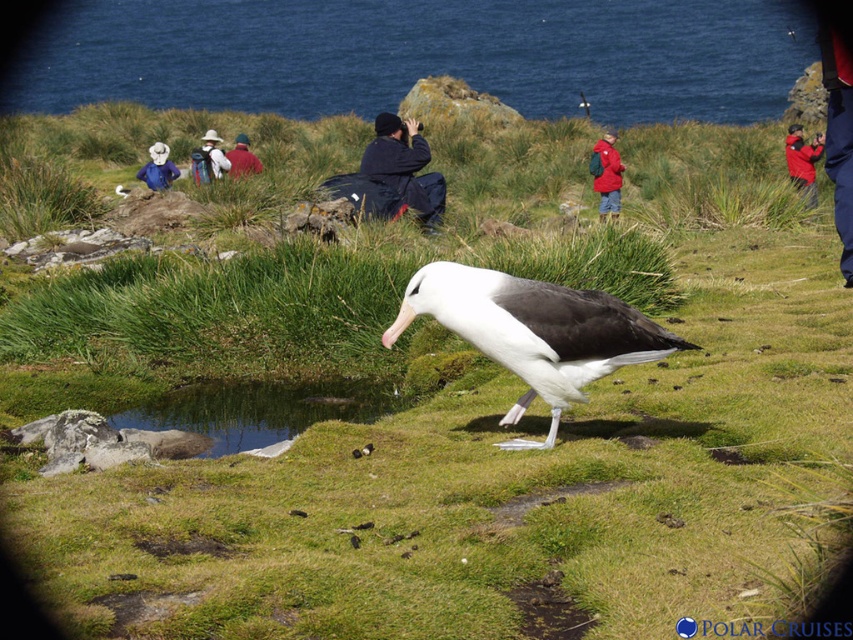
You are a photographer trying to capture a group photo of the people in the scene. You want to ensure both the red fabric jacket at center and the white matte jacket at upper left are visible in the frame. Based on their positions, which jacket should you position closer to the center of the photo to include both effectively?

The red fabric jacket at center is already positioned to the right of the white matte jacket at upper left. To include both effectively, you should position the red fabric jacket at center closer to the center of the photo since it is already on the right side, allowing the white matte jacket at upper left to be included on the left while balancing the composition.

You are a photographer trying to capture the entire scene of the blue water at upper center and the white fabric hat at upper center in one frame. Given that your camera can only focus on objects within a 100 cm width, will both objects fit in the frame?

The blue water at upper center is larger than the white fabric hat at upper center. Since the camera can focus on objects within a 100 cm width, both objects can fit in the frame as long as their combined size does not exceed 100 cm. However, the exact fit depends on their actual sizes, which aren

You are a photographer trying to capture both the dark blue jacket at center and the red fabric jacket at center in the same frame. Which jacket should you position closer to the left side of your camera viewfinder to include both?

To include both the dark blue jacket at center and the red fabric jacket at center in the same frame, position the dark blue jacket at center closer to the left side of your camera viewfinder since it is already to the left of the red fabric jacket at center.